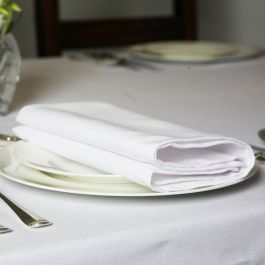
At what (x,y) coordinates should I click in order to perform the action: click on wooden chair. Please return your answer as a coordinate pair (x, y). The width and height of the screenshot is (265, 265). Looking at the image, I should click on (117, 32).